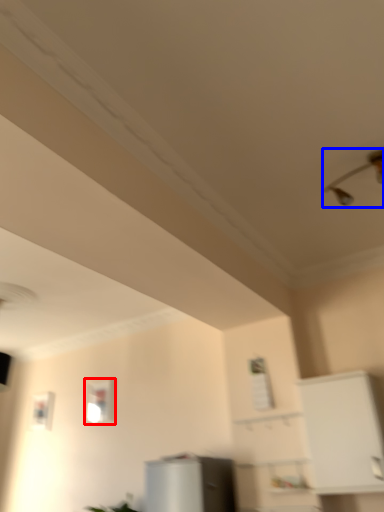
Question: Which of the following is the farthest to the observer, window (highlighted by a red box) or light fixture (highlighted by a blue box)?

Choices:
 (A) window
 (B) light fixture

Answer: (A)